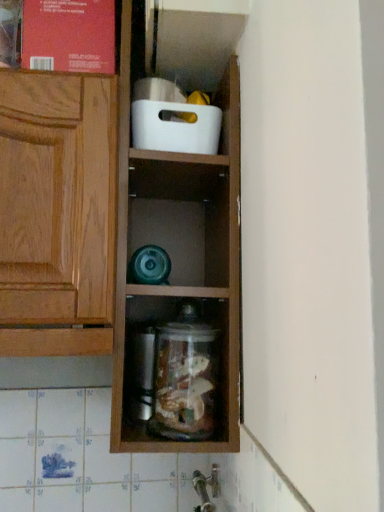
Question: Is matte red book at upper left thinner than white plastic container at upper center?

Choices:
 (A) no
 (B) yes

Answer: (A)

Question: Is matte red book at upper left in front of white plastic container at upper center?

Choices:
 (A) yes
 (B) no

Answer: (A)

Question: Does matte red book at upper left have a larger size compared to white plastic container at upper center?

Choices:
 (A) no
 (B) yes

Answer: (B)

Question: From the image's perspective, is matte red book at upper left located beneath white plastic container at upper center?

Choices:
 (A) no
 (B) yes

Answer: (A)

Question: Does matte red book at upper left have a greater width compared to white plastic container at upper center?

Choices:
 (A) yes
 (B) no

Answer: (A)

Question: Do you think matte red book at upper left is within silver metallic faucet at lower center, or outside of it?

Choices:
 (A) inside
 (B) outside

Answer: (B)

Question: From a real-world perspective, relative to silver metallic faucet at lower center, is matte red book at upper left vertically above or below?

Choices:
 (A) below
 (B) above

Answer: (B)

Question: Would you say matte red book at upper left is to the left or to the right of silver metallic faucet at lower center in the picture?

Choices:
 (A) right
 (B) left

Answer: (B)

Question: Is matte red book at upper left taller or shorter than silver metallic faucet at lower center?

Choices:
 (A) tall
 (B) short

Answer: (A)

Question: Is point coord(177,130) positioned closer to the camera than point coord(71,2)?

Choices:
 (A) farther
 (B) closer

Answer: (A)

Question: Based on their sizes in the image, would you say white plastic container at upper center is bigger or smaller than matte red book at upper left?

Choices:
 (A) small
 (B) big

Answer: (A)

Question: Looking at their shapes, would you say white plastic container at upper center is wider or thinner than matte red book at upper left?

Choices:
 (A) wide
 (B) thin

Answer: (B)

Question: From the image's perspective, is white plastic container at upper center located above or below matte red book at upper left?

Choices:
 (A) above
 (B) below

Answer: (B)

Question: Visually, is matte red book at upper left positioned to the left or to the right of clear glass jar at center?

Choices:
 (A) left
 (B) right

Answer: (A)

Question: From a real-world perspective, is matte red book at upper left physically located above or below clear glass jar at center?

Choices:
 (A) below
 (B) above

Answer: (B)